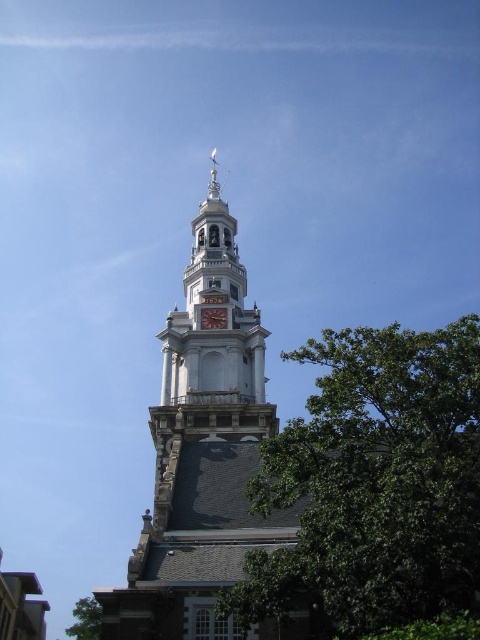
Question: Can you confirm if green leafy tree at right is positioned below matte gray clock at upper center?

Choices:
 (A) yes
 (B) no

Answer: (A)

Question: Can you confirm if green leafy tree at right is positioned above stone clock tower at center?

Choices:
 (A) no
 (B) yes

Answer: (A)

Question: Which object is farther from the camera taking this photo?

Choices:
 (A) green leafy tree at right
 (B) matte gray clock at upper center

Answer: (B)

Question: Observing the image, what is the correct spatial positioning of green leafy tree at right in reference to green leafy tree at lower left?

Choices:
 (A) below
 (B) above

Answer: (B)

Question: Which of these objects is positioned closest to the matte gray clock at upper center?

Choices:
 (A) green leafy tree at lower left
 (B) green leafy tree at right

Answer: (B)

Question: Among these objects, which one is farthest from the camera?

Choices:
 (A) stone clock tower at center
 (B) green leafy tree at lower left

Answer: (B)